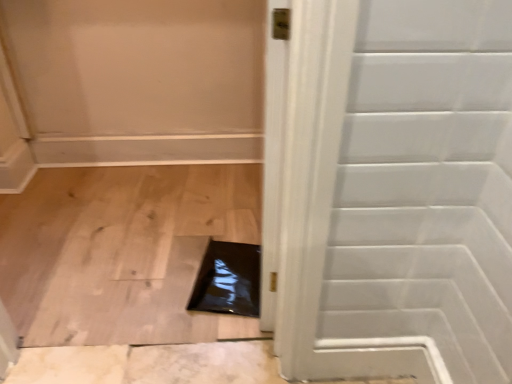
Question: In the image, is white glossy door at center on the left side or the right side of black glossy hole at center?

Choices:
 (A) right
 (B) left

Answer: (A)

Question: Is white glossy door at center taller or shorter than black glossy hole at center?

Choices:
 (A) tall
 (B) short

Answer: (A)

Question: In the image, is white glossy door at center positioned in front of or behind black glossy hole at center?

Choices:
 (A) behind
 (B) front

Answer: (B)

Question: Is point (250, 278) closer or farther from the camera than point (505, 254)?

Choices:
 (A) closer
 (B) farther

Answer: (B)

Question: Considering their positions, is black glossy hole at center located in front of or behind white glossy door at center?

Choices:
 (A) behind
 (B) front

Answer: (A)

Question: Is black glossy hole at center inside or outside of white glossy door at center?

Choices:
 (A) inside
 (B) outside

Answer: (B)

Question: Based on their sizes in the image, would you say black glossy hole at center is bigger or smaller than white glossy door at center?

Choices:
 (A) small
 (B) big

Answer: (A)